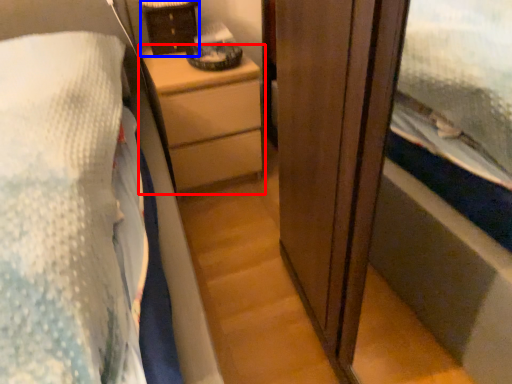
Question: Which object appears closest to the camera in this image, chest of drawers (highlighted by a red box) or cabinetry (highlighted by a blue box)?

Choices:
 (A) chest of drawers
 (B) cabinetry

Answer: (A)